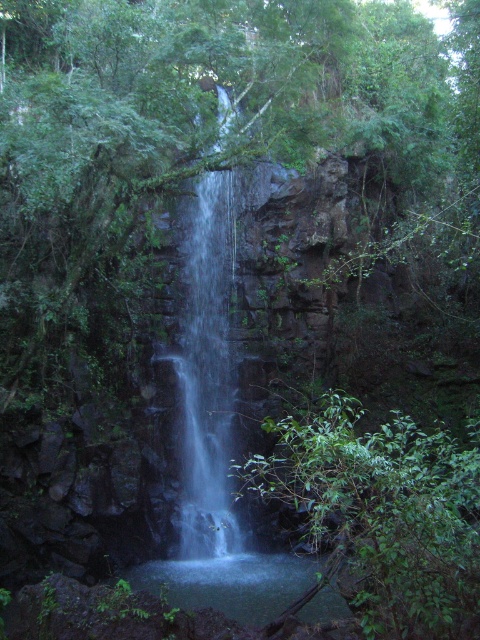
In the scene shown: Is green leafy tree at center shorter than clear water at center?

Yes.

Is green leafy tree at center wider than clear water at center?

Indeed, green leafy tree at center has a greater width compared to clear water at center.

Who is more forward, (475, 435) or (197, 339)?

Point (475, 435)

The height and width of the screenshot is (640, 480). I want to click on green leafy tree at center, so click(x=384, y=515).